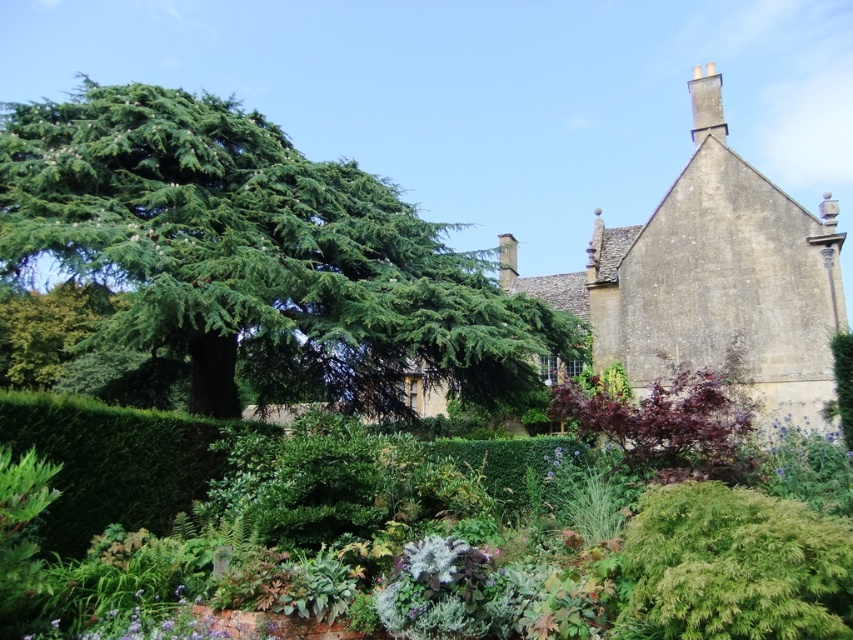
Question: Among these objects, which one is nearest to the camera?

Choices:
 (A) green leafy tree at upper left
 (B) silvery-gray fluffy plant at center

Answer: (B)

Question: Is green leafy tree at upper left above silvery-gray fluffy plant at center?

Choices:
 (A) no
 (B) yes

Answer: (B)

Question: Is green leafy tree at upper left closer to camera compared to silvery-gray fluffy plant at center?

Choices:
 (A) yes
 (B) no

Answer: (B)

Question: Is green leafy tree at upper left smaller than silvery-gray fluffy plant at center?

Choices:
 (A) yes
 (B) no

Answer: (B)

Question: Which of the following is the closest to the observer?

Choices:
 (A) green leafy tree at upper left
 (B) silvery-gray fluffy plant at center

Answer: (B)